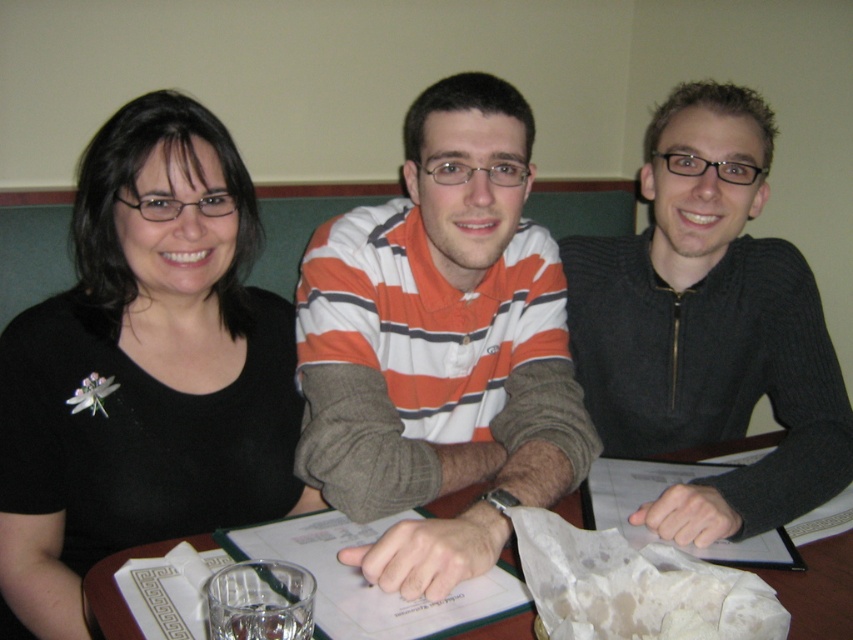
Question: Estimate the real-world distances between objects in this image. Which object is farther from the orange striped shirt at center?

Choices:
 (A) black matte shirt at upper left
 (B) wooden table at center

Answer: (B)

Question: Is black matte shirt at upper left further to camera compared to orange striped shirt at center?

Choices:
 (A) no
 (B) yes

Answer: (B)

Question: Where is black ribbed sweater at center located in relation to wooden table at center in the image?

Choices:
 (A) above
 (B) below

Answer: (A)

Question: Among these objects, which one is nearest to the camera?

Choices:
 (A) orange striped shirt at center
 (B) wooden table at center

Answer: (B)

Question: Which object is farther from the camera taking this photo?

Choices:
 (A) orange striped shirt at center
 (B) black ribbed sweater at center

Answer: (B)

Question: Considering the relative positions of orange striped shirt at center and black ribbed sweater at center in the image provided, where is orange striped shirt at center located with respect to black ribbed sweater at center?

Choices:
 (A) above
 (B) below

Answer: (B)